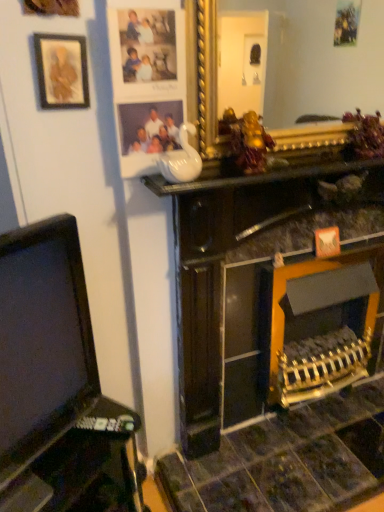
This screenshot has width=384, height=512. In order to click on free space above white glossy vase at upper center (from a real-world perspective) in this screenshot , I will do `click(280, 163)`.